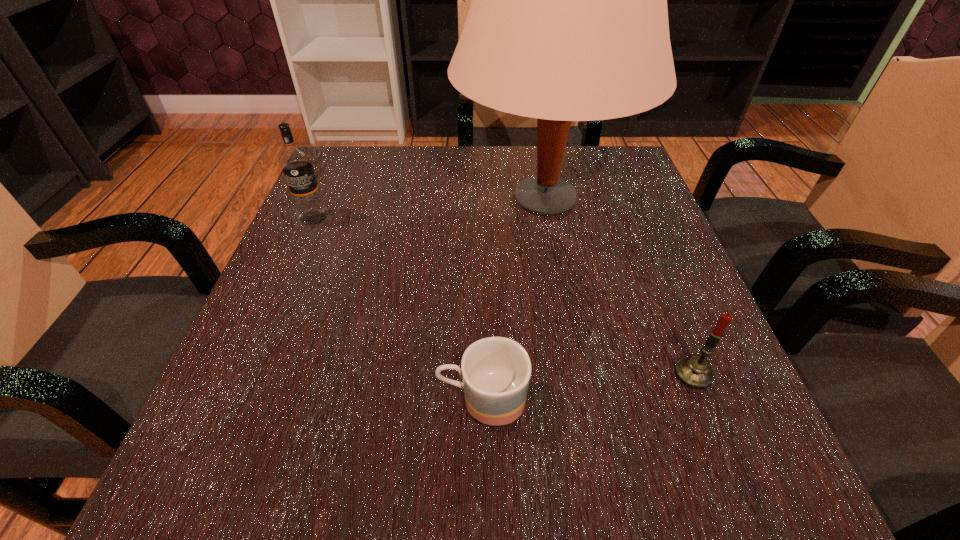
In the image, there is a desktop. Where is `vacant space at the right edge`? This screenshot has width=960, height=540. vacant space at the right edge is located at coordinates (690, 327).

Find the location of a particular element. free spot at the far left corner of the desktop is located at coordinates (342, 156).

This screenshot has width=960, height=540. Identify the location of vacant space at the far right corner of the desktop. (607, 178).

This screenshot has width=960, height=540. In the image, there is a desktop. In order to click on free space at the near right corner in this screenshot , I will do `click(770, 444)`.

Where is `vacant area that lies between the lampshade and the shortest object`? Image resolution: width=960 pixels, height=540 pixels. vacant area that lies between the lampshade and the shortest object is located at coordinates (514, 299).

Find the location of a particular element. This screenshot has width=960, height=540. free space between the shortest object and the vodka is located at coordinates (398, 308).

You are a GUI agent. You are given a task and a screenshot of the screen. Output one action in this format:
    pyautogui.click(x=<x>, y=<y>)
    Task: Click on the vacant space in between the second shortest object and the vodka
    
    Given the screenshot: What is the action you would take?
    pyautogui.click(x=503, y=296)

The image size is (960, 540). Identify the location of vacant point located between the third tallest object and the second tallest object. (503, 296).

Find the location of `free spot between the shortest object and the leftmost object`. free spot between the shortest object and the leftmost object is located at coordinates (398, 308).

The image size is (960, 540). Find the location of `vacant region between the lampshade and the leftmost object`. vacant region between the lampshade and the leftmost object is located at coordinates (429, 209).